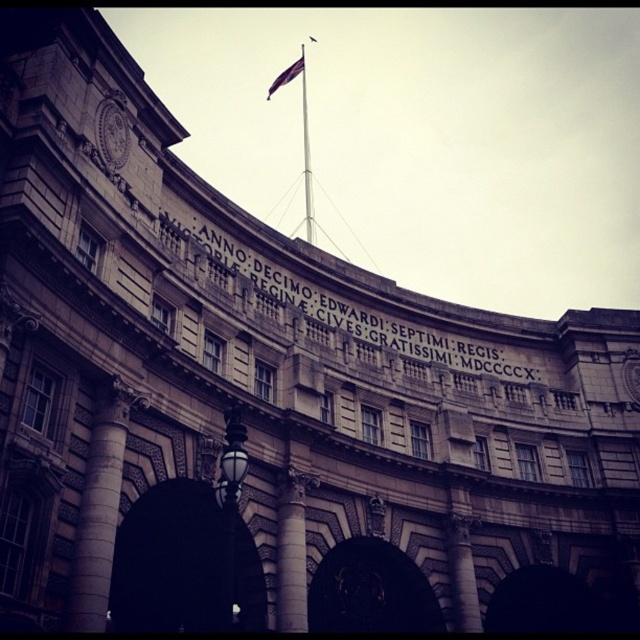
Question: Can you confirm if stone column at center is positioned below polished brass streetlight at lower left?

Choices:
 (A) yes
 (B) no

Answer: (A)

Question: Is metallic flag pole at center wider than silky purple flag at center?

Choices:
 (A) no
 (B) yes

Answer: (A)

Question: Which object is positioned farthest from the silky purple flag at center?

Choices:
 (A) stone inscription at center
 (B) metallic flag pole at center

Answer: (A)

Question: Is stone inscription at center positioned before silky purple flag at center?

Choices:
 (A) no
 (B) yes

Answer: (B)

Question: Which of these objects is positioned farthest from the polished brass streetlight at lower left?

Choices:
 (A) stone column at center
 (B) stone inscription at center

Answer: (B)

Question: Among these points, which one is nearest to the camera?

Choices:
 (A) (396, 337)
 (B) (301, 51)
 (C) (296, 545)
 (D) (288, 76)

Answer: (C)